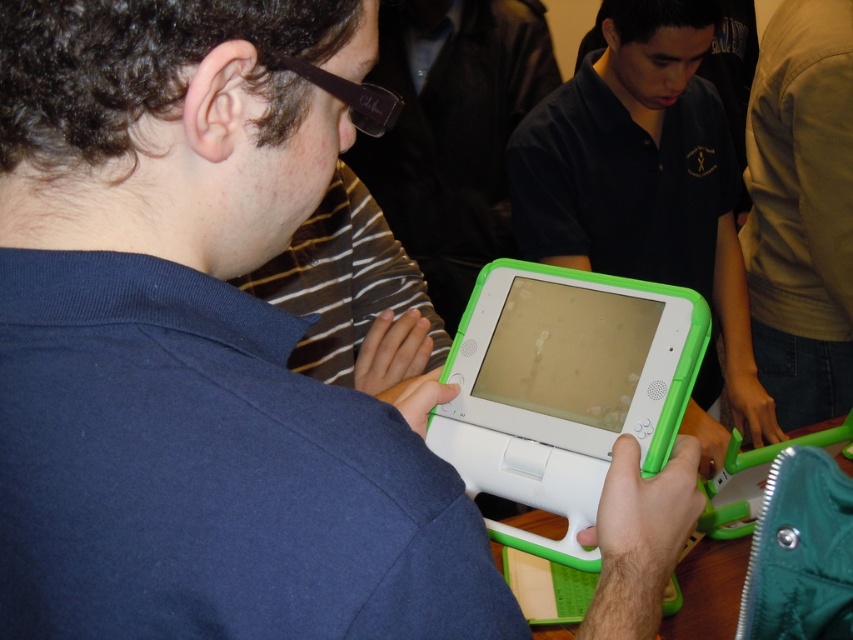
Question: Does matte green tablet at center appear over white plastic tablet at center?

Choices:
 (A) yes
 (B) no

Answer: (A)

Question: Which of the following is the farthest from the observer?

Choices:
 (A) white plastic tablet at center
 (B) matte green tablet at center

Answer: (B)

Question: Which point appears farthest from the camera in this image?

Choices:
 (A) (614, 61)
 (B) (518, 449)

Answer: (A)

Question: Is matte green tablet at center below white plastic tablet at center?

Choices:
 (A) no
 (B) yes

Answer: (A)

Question: Observing the image, what is the correct spatial positioning of matte green tablet at center in reference to white plastic tablet at center?

Choices:
 (A) above
 (B) below

Answer: (A)

Question: Which point is farther to the camera?

Choices:
 (A) matte green tablet at center
 (B) white plastic tablet at center

Answer: (A)